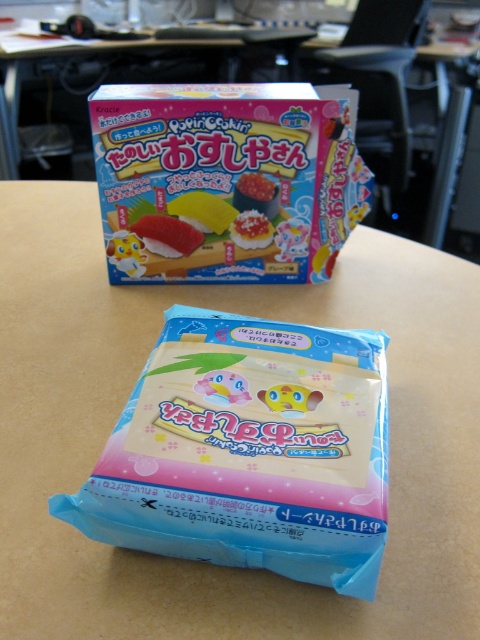
Can you confirm if light brown wood at center is bigger than matte yellow plastic toy at center?

Yes, light brown wood at center is bigger than matte yellow plastic toy at center.

Who is shorter, light brown wood at center or matte yellow plastic toy at center?

Standing shorter between the two is matte yellow plastic toy at center.

Measure the distance between light brown wood at center and camera.

light brown wood at center and camera are 36.94 inches apart.

At what (x,y) coordinates should I click in order to perform the action: click on light brown wood at center. Please return your answer as a coordinate pair (x, y). Looking at the image, I should click on (130, 392).

Between matte plastic toy at upper center and matte yellow plastic toy at center, which one appears on the left side from the viewer's perspective?

Positioned to the left is matte plastic toy at upper center.

Looking at this image, between matte plastic toy at upper center and matte yellow plastic toy at center, which one is positioned lower?

Positioned lower is matte yellow plastic toy at center.

Measure the distance between matte plastic toy at upper center and camera.

They are 4.11 feet apart.

Where is `matte plastic toy at upper center`? Image resolution: width=480 pixels, height=640 pixels. matte plastic toy at upper center is located at coordinates (227, 180).

Between point (259, 612) and point (96, 109), which one is positioned behind?

Positioned behind is point (96, 109).

Locate an element on the screen. The image size is (480, 640). light brown wood at center is located at coordinates (130, 392).

Locate an element on the screen. The image size is (480, 640). light brown wood at center is located at coordinates (130, 392).